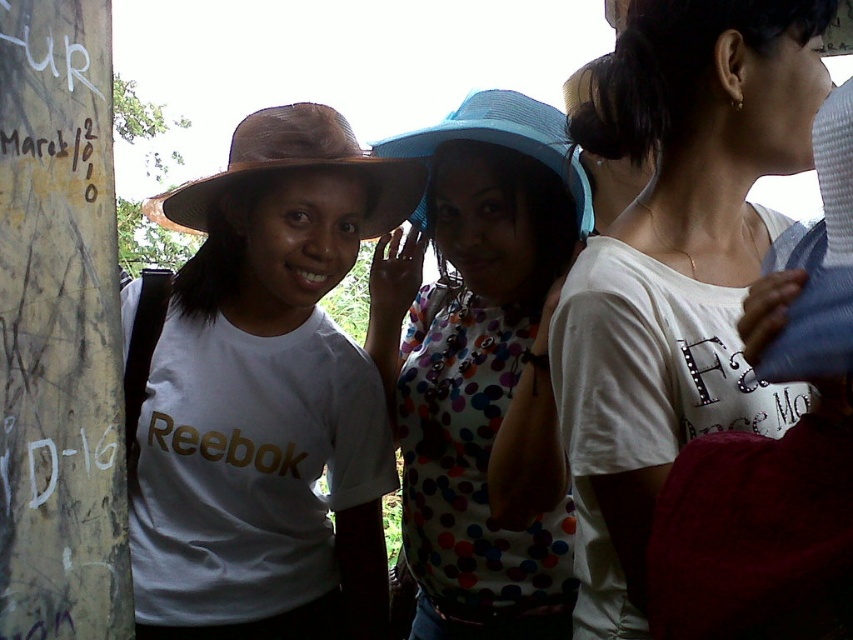
Question: Is white cotton shirt at upper right smaller than blue fabric hat at upper right?

Choices:
 (A) no
 (B) yes

Answer: (A)

Question: Does polka dot fabric shirt at center have a smaller size compared to blue woven hat at center?

Choices:
 (A) yes
 (B) no

Answer: (B)

Question: From the image, what is the correct spatial relationship of white cotton shirt at upper right in relation to polka dot fabric shirt at center?

Choices:
 (A) above
 (B) below

Answer: (A)

Question: Which point is closer to the camera?

Choices:
 (A) polka dot fabric shirt at center
 (B) brown woven hat at left
 (C) blue woven hat at center
 (D) matte brown hat at left

Answer: (A)

Question: Which point is closer to the camera?

Choices:
 (A) blue woven hat at center
 (B) blue fabric hat at upper right
 (C) brown woven hat at left

Answer: (B)

Question: Estimate the real-world distances between objects in this image. Which object is farther from the white cotton shirt at upper right?

Choices:
 (A) blue fabric hat at upper right
 (B) matte brown hat at left
 (C) weathered concrete pillar at left

Answer: (C)